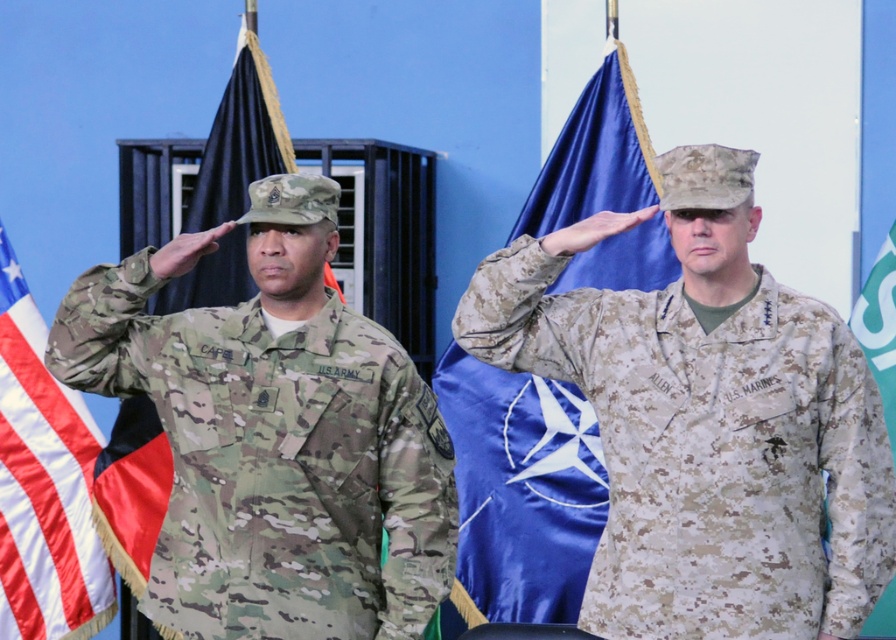
Does camouflage fabric uniform at right have a larger size compared to blue satin flag at center?

Yes.

Who is higher up, camouflage fabric uniform at right or blue satin flag at center?

Positioned higher is camouflage fabric uniform at right.

Is point (817, 513) in front of point (477, 497)?

Yes, it is.

This screenshot has width=896, height=640. In order to click on camouflage fabric uniform at right in this screenshot , I will do coord(708,449).

Consider the image. Which is more to the left, camouflage fabric uniform at right or multicam uniform at left?

multicam uniform at left

Does camouflage fabric uniform at right have a larger size compared to multicam uniform at left?

No.

Between point (815, 595) and point (291, 413), which one is positioned in front?

Point (815, 595) is more forward.

The image size is (896, 640). I want to click on camouflage fabric uniform at right, so click(x=708, y=449).

Measure the distance between black fabric flag at left and camouflage fabric flag at right.

They are 3.73 meters apart.

Between point (168, 157) and point (869, 332), which one is positioned behind?

Point (168, 157)

In order to click on black fabric flag at left in this screenshot , I will do `click(209, 157)`.